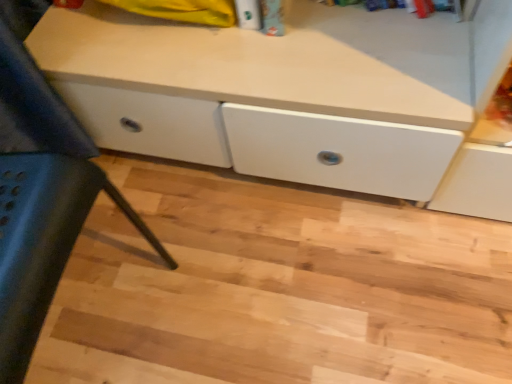
Question: Is natural wood stair at center looking in the opposite direction of matte white cabinet at lower left?

Choices:
 (A) yes
 (B) no

Answer: (B)

Question: From a real-world perspective, is natural wood stair at center under matte white cabinet at lower left?

Choices:
 (A) no
 (B) yes

Answer: (B)

Question: Is natural wood stair at center far away from matte white cabinet at lower left?

Choices:
 (A) no
 (B) yes

Answer: (A)

Question: Is natural wood stair at center wider than matte white cabinet at lower left?

Choices:
 (A) yes
 (B) no

Answer: (A)

Question: Can you confirm if natural wood stair at center is positioned to the right of matte white cabinet at lower left?

Choices:
 (A) no
 (B) yes

Answer: (B)

Question: Is natural wood stair at center further to camera compared to matte white cabinet at lower left?

Choices:
 (A) yes
 (B) no

Answer: (A)

Question: Can you confirm if matte white cabinet at lower left is positioned to the left of natural wood stair at center?

Choices:
 (A) yes
 (B) no

Answer: (A)

Question: Does matte white cabinet at lower left have a greater width compared to natural wood stair at center?

Choices:
 (A) yes
 (B) no

Answer: (B)

Question: From a real-world perspective, is matte white cabinet at lower left physically below natural wood stair at center?

Choices:
 (A) no
 (B) yes

Answer: (A)

Question: Is matte white cabinet at lower left thinner than natural wood stair at center?

Choices:
 (A) yes
 (B) no

Answer: (A)

Question: From the image's perspective, does matte white cabinet at lower left appear lower than natural wood stair at center?

Choices:
 (A) no
 (B) yes

Answer: (A)

Question: Is natural wood stair at center located within matte white cabinet at lower left?

Choices:
 (A) no
 (B) yes

Answer: (A)

Question: Is natural wood stair at center wider or thinner than matte white cabinet at lower left?

Choices:
 (A) thin
 (B) wide

Answer: (B)